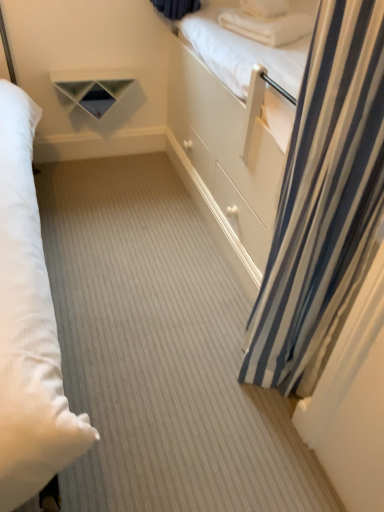
Image resolution: width=384 pixels, height=512 pixels. What are the coordinates of `vacant area that is in front of blue striped curtain at right` in the screenshot? It's located at (244, 430).